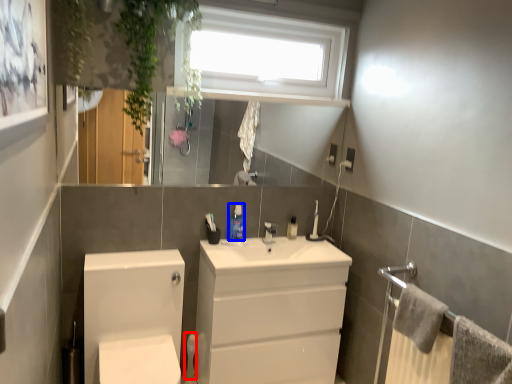
Question: Which point is closer to the camera, toilet paper (highlighted by a red box) or toiletry (highlighted by a blue box)?

Choices:
 (A) toilet paper
 (B) toiletry

Answer: (B)